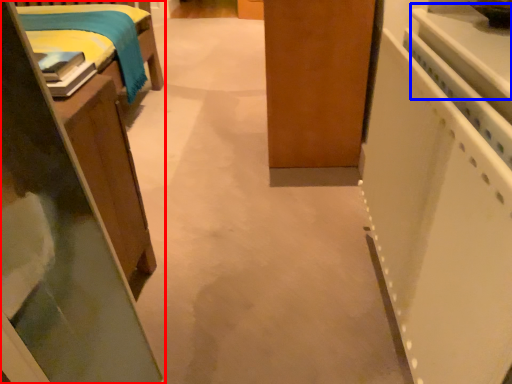
Question: Which of the following is the closest to the observer, furniture (highlighted by a red box) or counter top (highlighted by a blue box)?

Choices:
 (A) furniture
 (B) counter top

Answer: (B)